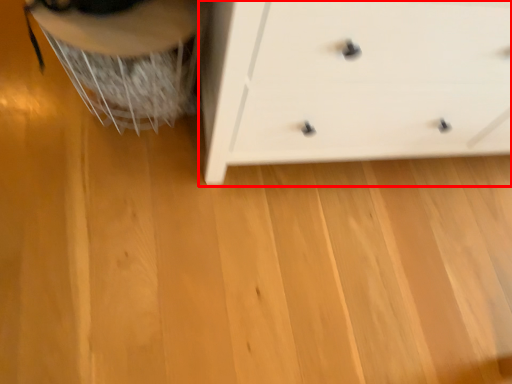
Question: From the image's perspective, considering the relative positions of chest of drawers (annotated by the red box) and swivel chair in the image provided, where is chest of drawers (annotated by the red box) located with respect to the staircase?

Choices:
 (A) above
 (B) below

Answer: (A)